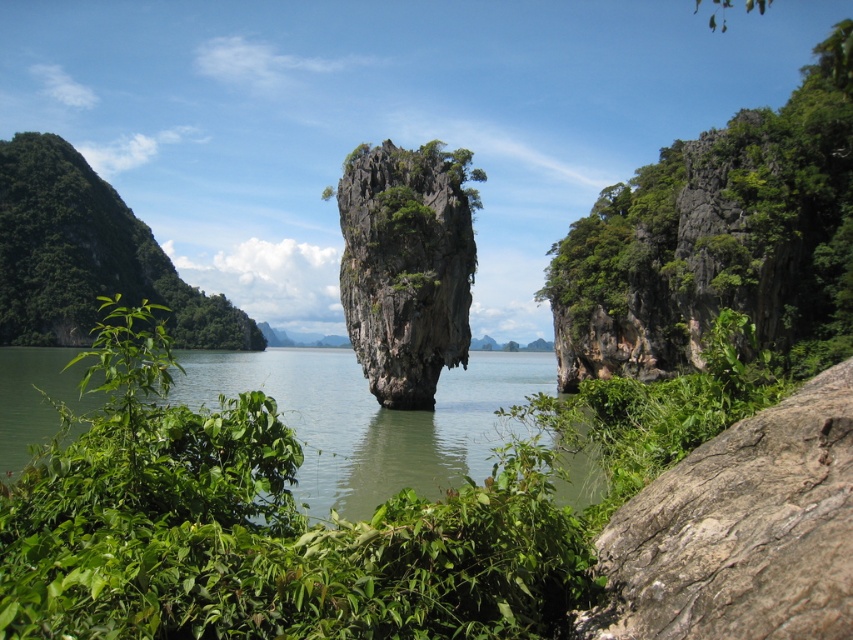
Question: Can you confirm if green water at center is positioned to the right of green leafy shrub at left?

Choices:
 (A) no
 (B) yes

Answer: (B)

Question: Is gray rough rock at center smaller than green leafy shrub at left?

Choices:
 (A) yes
 (B) no

Answer: (A)

Question: Does green water at center appear over green leafy shrub at left?

Choices:
 (A) no
 (B) yes

Answer: (A)

Question: Which of the following is the closest to the observer?

Choices:
 (A) green water at center
 (B) green mossy rock at center
 (C) green leafy shrub at left
 (D) gray rough rock at center

Answer: (D)

Question: Which point is farther from the camera taking this photo?

Choices:
 (A) coord(532,358)
 (B) coord(613,552)
 (C) coord(741,134)

Answer: (A)

Question: Estimate the real-world distances between objects in this image. Which object is farther from the green water at center?

Choices:
 (A) green mossy rock at center
 (B) green leafy rock at right

Answer: (B)